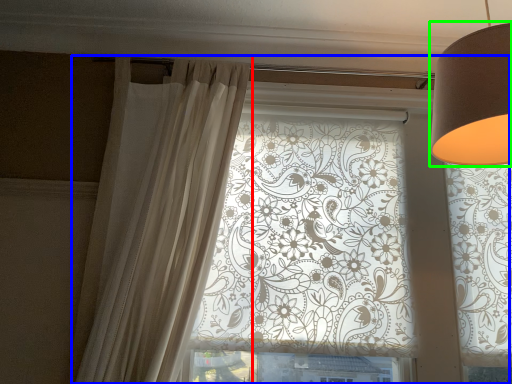
Question: Considering the real-world distances, which object is farthest from curtain (highlighted by a red box)? window (highlighted by a blue box) or lamp (highlighted by a green box)?

Choices:
 (A) window
 (B) lamp

Answer: (B)